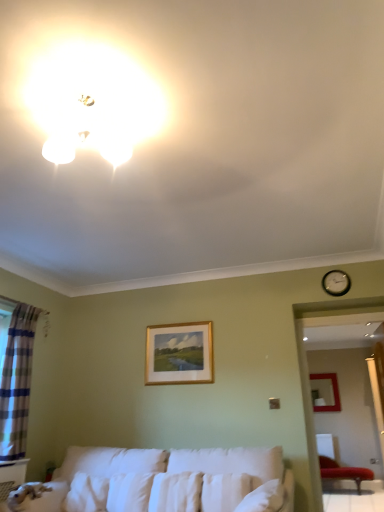
Question: From a real-world perspective, relative to matte gold picture frame at center-right, acting as the second picture frame starting from the left, is plaid fabric curtain at left vertically above or below?

Choices:
 (A) below
 (B) above

Answer: (A)

Question: From the image's perspective, relative to matte gold picture frame at center-right, which appears as the 1th picture frame when ordered from the bottom, is plaid fabric curtain at left above or below?

Choices:
 (A) below
 (B) above

Answer: (B)

Question: Which of these objects is positioned closest to the white fabric couch at lower center?

Choices:
 (A) gold wooden picture frame at center, which is the 2th picture frame in right-to-left order
 (B) white soft pillow at center, arranged as the first pillow when viewed from the right
 (C) velvet red chair at lower right
 (D) white soft pillow at center, acting as the 2th pillow starting from the right
 (E) matte gold picture frame at center-right, the 1th picture frame viewed from the right

Answer: (D)

Question: Estimate the real-world distances between objects in this image. Which object is farther from the white fabric couch at lower center?

Choices:
 (A) red leather bench at lower right
 (B) velvet red chair at lower right
 (C) white soft pillow at center, arranged as the first pillow when viewed from the right
 (D) gold wooden picture frame at center, the second picture frame from the back
 (E) plaid fabric curtain at left

Answer: (B)